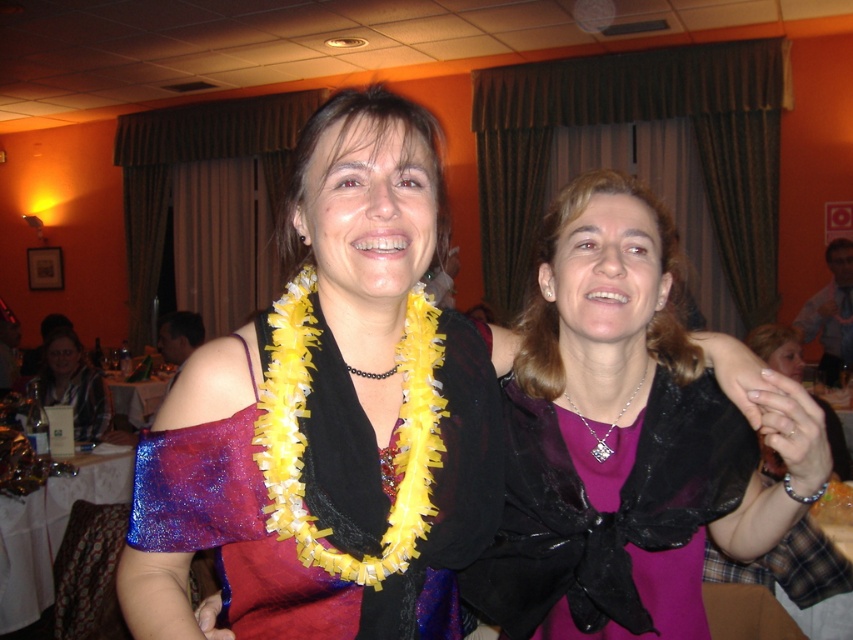
Question: Which point is farther to the camera?

Choices:
 (A) (619, 296)
 (B) (670, 433)

Answer: (B)

Question: Can you confirm if purple satin blouse at center is bigger than plaid shirt at left?

Choices:
 (A) no
 (B) yes

Answer: (A)

Question: Among these objects, which one is farthest from the camera?

Choices:
 (A) purple satin blouse at center
 (B) shiny purple fabric dress at center
 (C) plaid shirt at left

Answer: (C)

Question: Can you confirm if purple satin blouse at center is positioned above plaid shirt at left?

Choices:
 (A) no
 (B) yes

Answer: (B)

Question: Does purple satin blouse at center lie in front of plaid shirt at left?

Choices:
 (A) no
 (B) yes

Answer: (B)

Question: Which point is closer to the camera?

Choices:
 (A) purple satin dress at center
 (B) shiny purple fabric dress at center

Answer: (B)